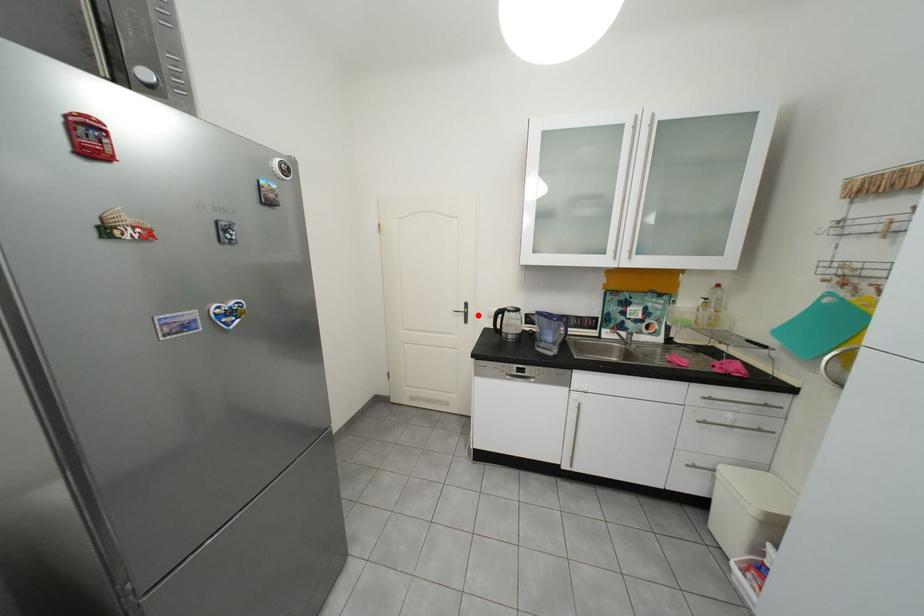
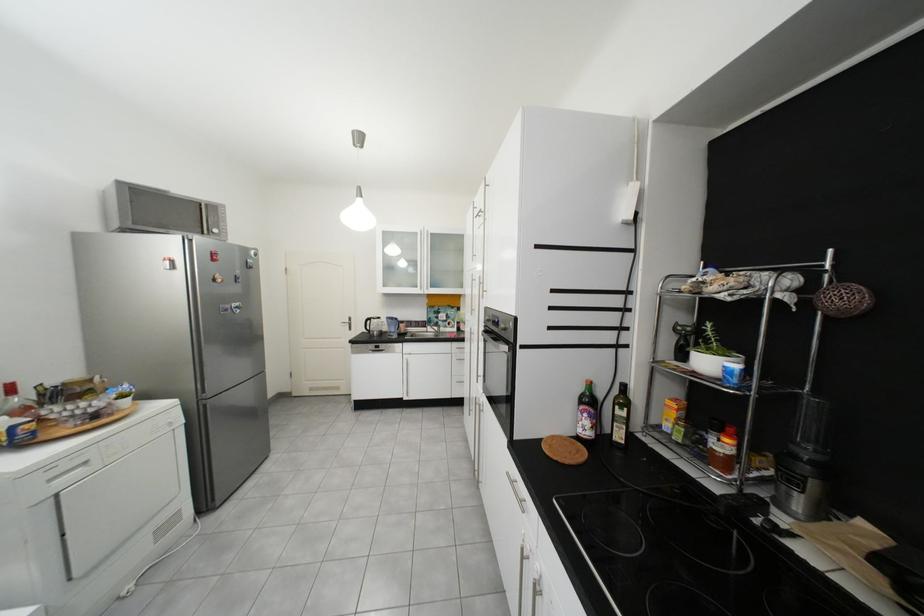
The point at the highlighted location is marked in the first image. Where is the corresponding point in the second image?

(361, 325)